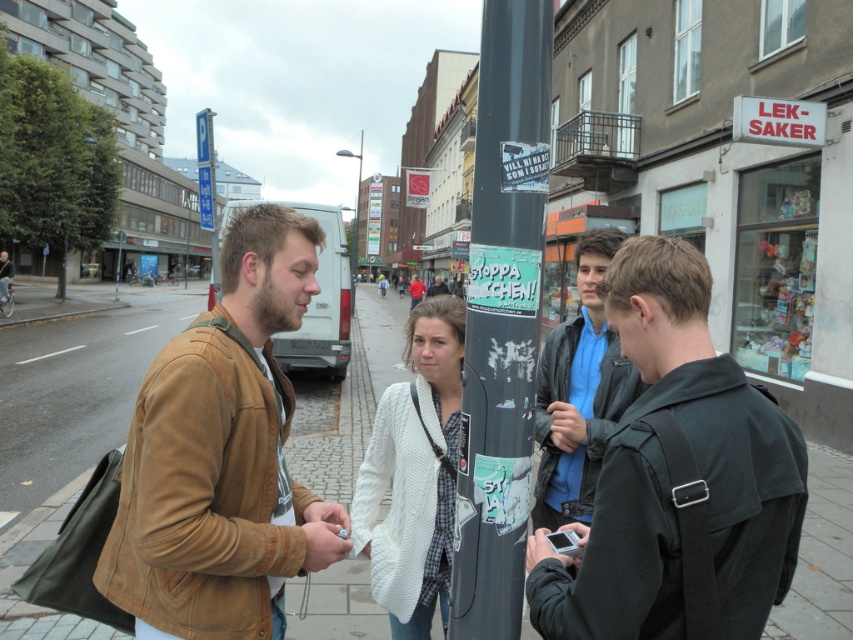
Based on the photo, you are a delivery person trying to navigate through the sidewalk. You see the cobblestone pavement at lower center and the light brown leather jacket at center. Which object is positioned to the left of the other?

The cobblestone pavement at lower center is to the left of the light brown leather jacket at center.

You are standing at the point with coordinates point (421, 292) and want to walk towards the black pole in the scene. Is the point point (573, 474) located in front of or behind you as you face the black pole?

The point (573, 474) is in front of point (421, 292), so as you face the black pole, the point (573, 474) would be in front of you.

You are a photographer standing at the camera position. You want to take a photo that includes both the point at coordinates point (x=796, y=490) and point (x=413, y=300). Which point should you focus on first to ensure both are in focus?

You should focus on point (x=796, y=490) first because it is closer to the camera, ensuring that both points will be in focus when using a proper depth of field.